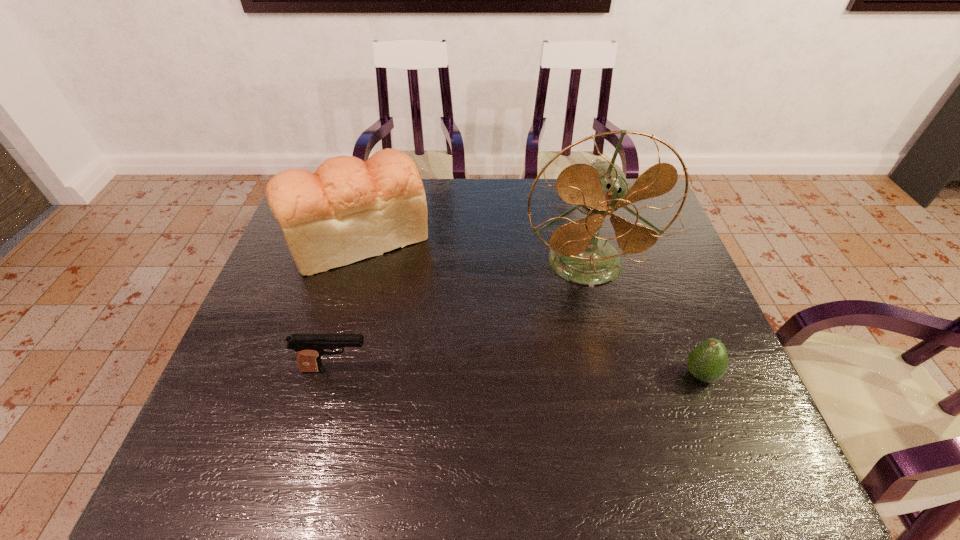
At what (x,y) coordinates should I click in order to perform the action: click on the tallest object. Please return your answer as a coordinate pair (x, y). This screenshot has height=540, width=960. Looking at the image, I should click on (577, 253).

Where is `the third shortest object`? The height and width of the screenshot is (540, 960). the third shortest object is located at coordinates (x=348, y=210).

This screenshot has height=540, width=960. What are the coordinates of `pistol` in the screenshot? It's located at (309, 347).

Identify the location of avocado. (707, 362).

This screenshot has width=960, height=540. Find the location of `free point located in front of the fan, directing air flow`. free point located in front of the fan, directing air flow is located at coordinates (628, 438).

Image resolution: width=960 pixels, height=540 pixels. I want to click on free region located on the right of the third shortest object, so click(485, 237).

Image resolution: width=960 pixels, height=540 pixels. Find the location of `vacant space located at the barrel of the pistol`. vacant space located at the barrel of the pistol is located at coordinates (484, 369).

Locate an element on the screen. free space located 0.190m on the front of the avocado is located at coordinates (742, 481).

Where is `object positioned at the far edge`? The image size is (960, 540). object positioned at the far edge is located at coordinates (348, 210).

Where is `bread located in the left edge section of the desktop`? This screenshot has width=960, height=540. bread located in the left edge section of the desktop is located at coordinates (348, 210).